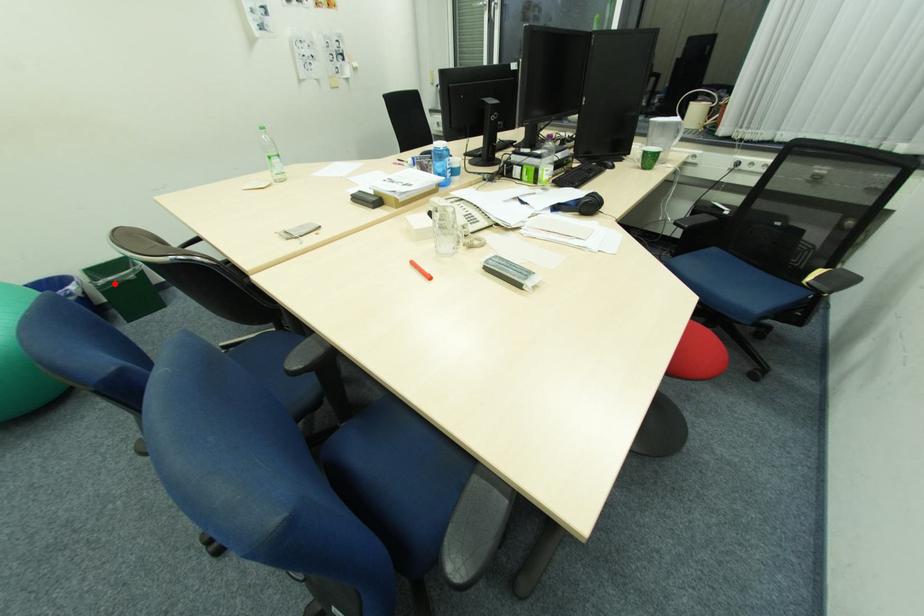
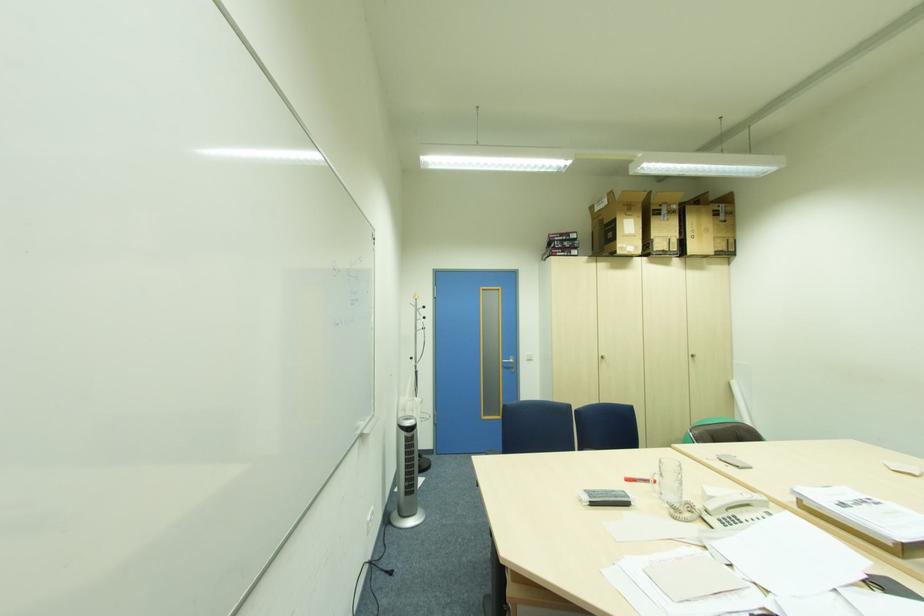
Question: I am providing you with two images of the same scene from different viewpoints. A red point is marked on the first image. Is the red point's position out of view in image 2?

Choices:
 (A) Yes
 (B) No

Answer: (A)